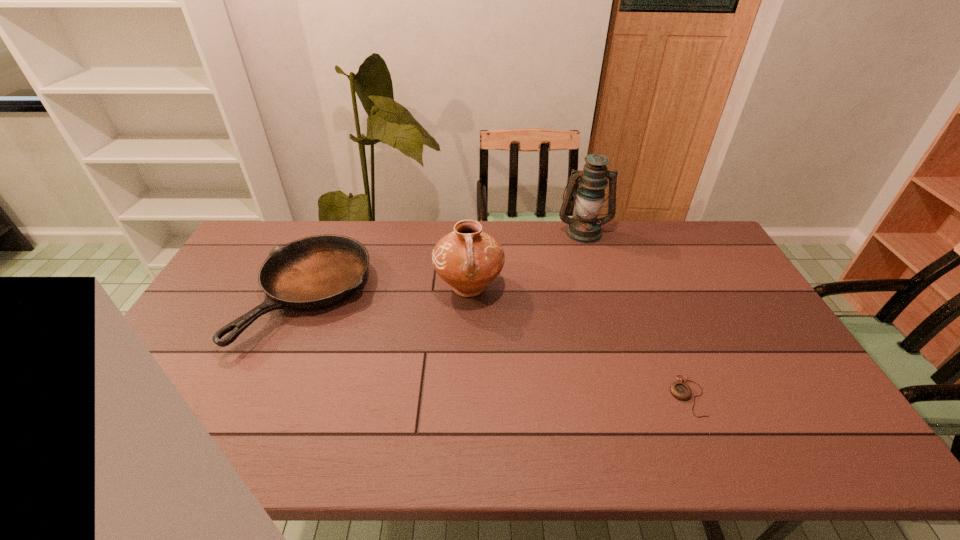
Find the location of a particular element. the tallest object is located at coordinates (584, 227).

You are a GUI agent. You are given a task and a screenshot of the screen. Output one action in this format:
    pyautogui.click(x=<x>, y=<y>)
    Task: Click on the farthest object
    This screenshot has width=960, height=540.
    Given the screenshot: What is the action you would take?
    pyautogui.click(x=584, y=227)

Identify the location of the third object from right to left. (468, 259).

The width and height of the screenshot is (960, 540). Find the location of `the third shortest object`. the third shortest object is located at coordinates (468, 259).

Find the location of `the third tallest object`. the third tallest object is located at coordinates (316, 272).

Locate an element on the screen. The image size is (960, 540). the leftmost object is located at coordinates (316, 272).

The width and height of the screenshot is (960, 540). In order to click on pocket watch in this screenshot , I will do `click(680, 390)`.

The height and width of the screenshot is (540, 960). I want to click on the nearest object, so tap(680, 390).

Where is `vacant region located on the right of the farthest object`? This screenshot has width=960, height=540. vacant region located on the right of the farthest object is located at coordinates (639, 232).

Locate an element on the screen. vacant position located 0.370m on the side of the third object from right to left with the handle is located at coordinates (466, 422).